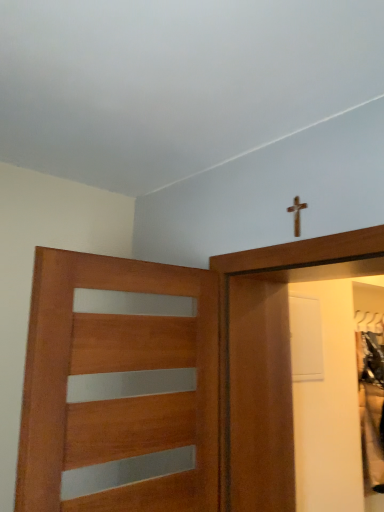
This screenshot has width=384, height=512. What are the coordinates of `wooden cross at upper center` in the screenshot? It's located at (297, 214).

Describe the element at coordinates (297, 214) in the screenshot. I see `wooden cross at upper center` at that location.

Describe the element at coordinates (174, 367) in the screenshot. I see `wooden door with frosted glass panels at left` at that location.

Where is `wooden door with frosted glass panels at left`? wooden door with frosted glass panels at left is located at coordinates (174, 367).

At what (x,y) coordinates should I click in order to perform the action: click on wooden cross at upper center. Please return your answer as a coordinate pair (x, y). Looking at the image, I should click on (297, 214).

Consider the image. Does wooden cross at upper center appear on the right side of wooden door with frosted glass panels at left?

Yes, wooden cross at upper center is to the right of wooden door with frosted glass panels at left.

Between wooden cross at upper center and wooden door with frosted glass panels at left, which one is positioned in front?

wooden door with frosted glass panels at left.

Is point (294, 226) closer or farther from the camera than point (289, 495)?

Clearly, point (294, 226) is closer to the camera than point (289, 495).

From the image's perspective, does wooden cross at upper center appear lower than wooden door with frosted glass panels at left?

No, from the image's perspective, wooden cross at upper center is not beneath wooden door with frosted glass panels at left.

From a real-world perspective, is wooden cross at upper center over wooden door with frosted glass panels at left?

Correct, in the physical world, wooden cross at upper center is higher than wooden door with frosted glass panels at left.

Is wooden cross at upper center wider or thinner than wooden door with frosted glass panels at left?

In the image, wooden cross at upper center appears to be more narrow than wooden door with frosted glass panels at left.

In terms of height, does wooden cross at upper center look taller or shorter compared to wooden door with frosted glass panels at left?

Considering their sizes, wooden cross at upper center has less height than wooden door with frosted glass panels at left.

Is wooden cross at upper center bigger or smaller than wooden door with frosted glass panels at left?

Clearly, wooden cross at upper center is smaller in size than wooden door with frosted glass panels at left.

Is wooden door with frosted glass panels at left a part of wooden cross at upper center?

No, wooden door with frosted glass panels at left is located outside of wooden cross at upper center.

Is wooden cross at upper center next to wooden door with frosted glass panels at left?

No, wooden cross at upper center is not with wooden door with frosted glass panels at left.

Is wooden cross at upper center turned away from wooden door with frosted glass panels at left?

wooden cross at upper center does not have its back to wooden door with frosted glass panels at left.

I want to click on crucifix that appears above the wooden door with frosted glass panels at left (from the image's perspective), so click(297, 214).

Can you confirm if wooden door with frosted glass panels at left is positioned to the left of wooden cross at upper center?

Indeed, wooden door with frosted glass panels at left is positioned on the left side of wooden cross at upper center.

Which object is closer to the camera taking this photo, wooden door with frosted glass panels at left or wooden cross at upper center?

wooden door with frosted glass panels at left is more forward.

Does point (150, 351) come behind point (300, 230)?

No, (150, 351) is closer to viewer.

From the image's perspective, who appears lower, wooden door with frosted glass panels at left or wooden cross at upper center?

wooden door with frosted glass panels at left, from the image's perspective.

From a real-world perspective, which object rests below the other?

wooden door with frosted glass panels at left, from a real-world perspective.

Considering the relative sizes of wooden door with frosted glass panels at left and wooden cross at upper center in the image provided, is wooden door with frosted glass panels at left wider than wooden cross at upper center?

Yes, wooden door with frosted glass panels at left is wider than wooden cross at upper center.

Considering the sizes of wooden door with frosted glass panels at left and wooden cross at upper center in the image, is wooden door with frosted glass panels at left taller or shorter than wooden cross at upper center?

In the image, wooden door with frosted glass panels at left appears to be taller than wooden cross at upper center.

Does wooden door with frosted glass panels at left have a smaller size compared to wooden cross at upper center?

Incorrect, wooden door with frosted glass panels at left is not smaller in size than wooden cross at upper center.

Is wooden cross at upper center completely or partially inside wooden door with frosted glass panels at left?

Definitely not — wooden cross at upper center is not inside wooden door with frosted glass panels at left.

Are wooden door with frosted glass panels at left and wooden cross at upper center located far from each other?

wooden door with frosted glass panels at left is near wooden cross at upper center, not far away.

Is wooden door with frosted glass panels at left oriented away from wooden cross at upper center?

wooden door with frosted glass panels at left does not have its back to wooden cross at upper center.

This screenshot has height=512, width=384. In order to click on door on the left of wooden cross at upper center in this screenshot , I will do `click(174, 367)`.

The height and width of the screenshot is (512, 384). In order to click on door on the left of the wooden cross at upper center in this screenshot , I will do `click(174, 367)`.

Where is `crucifix behind the wooden door with frosted glass panels at left`? Image resolution: width=384 pixels, height=512 pixels. crucifix behind the wooden door with frosted glass panels at left is located at coordinates (297, 214).